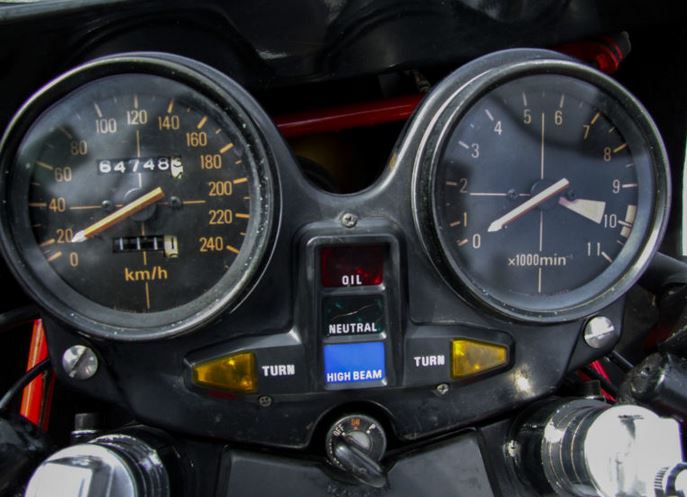
You are a GUI agent. You are given a task and a screenshot of the screen. Output one action in this format:
    pyautogui.click(x=<x>, y=<y>)
    Task: Click on the glass
    The height and width of the screenshot is (497, 687).
    Given the screenshot: What is the action you would take?
    pyautogui.click(x=571, y=177)